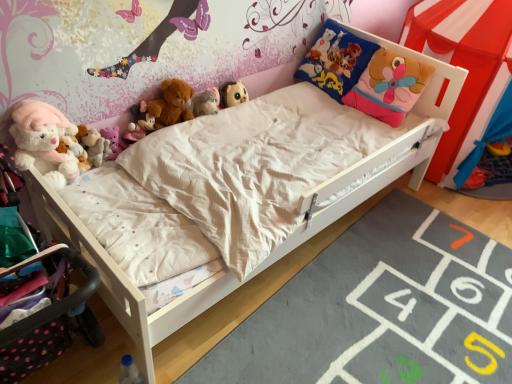
Question: From a real-world perspective, is blue plastic bottle at lower left, the 8th toy from the top, on soft plush pillow at upper right?

Choices:
 (A) no
 (B) yes

Answer: (A)

Question: Is blue plastic bottle at lower left, the first toy ordered from the bottom, at the right side of soft plush pillow at upper right?

Choices:
 (A) yes
 (B) no

Answer: (B)

Question: Is blue plastic bottle at lower left, the first toy ordered from the bottom, oriented away from soft plush pillow at upper right?

Choices:
 (A) yes
 (B) no

Answer: (B)

Question: Is the surface of blue plastic bottle at lower left, the first toy ordered from the bottom, in direct contact with soft plush pillow at upper right?

Choices:
 (A) no
 (B) yes

Answer: (A)

Question: From the image's perspective, is blue plastic bottle at lower left, the 8th toy from the top, on top of soft plush pillow at upper right?

Choices:
 (A) no
 (B) yes

Answer: (A)

Question: Considering the relative sizes of blue plastic bottle at lower left, the first toy ordered from the bottom, and soft plush pillow at upper right in the image provided, is blue plastic bottle at lower left, the first toy ordered from the bottom, thinner than soft plush pillow at upper right?

Choices:
 (A) no
 (B) yes

Answer: (B)

Question: Considering the relative sizes of fluffy white teddy bear at center, which ranks as the 1th toy in top-to-bottom order, and red fabric canopy bed at upper right in the image provided, is fluffy white teddy bear at center, which ranks as the 1th toy in top-to-bottom order, taller than red fabric canopy bed at upper right?

Choices:
 (A) yes
 (B) no

Answer: (B)

Question: Can you confirm if fluffy white teddy bear at center, positioned as the 8th toy in bottom-to-top order, is shorter than red fabric canopy bed at upper right?

Choices:
 (A) yes
 (B) no

Answer: (A)

Question: From the image's perspective, is fluffy white teddy bear at center, positioned as the 8th toy in bottom-to-top order, located beneath red fabric canopy bed at upper right?

Choices:
 (A) yes
 (B) no

Answer: (A)

Question: Is fluffy white teddy bear at center, positioned as the 8th toy in bottom-to-top order, at the right side of red fabric canopy bed at upper right?

Choices:
 (A) yes
 (B) no

Answer: (B)

Question: Does fluffy white teddy bear at center, which ranks as the 1th toy in top-to-bottom order, have a larger size compared to red fabric canopy bed at upper right?

Choices:
 (A) no
 (B) yes

Answer: (A)

Question: Does fluffy white teddy bear at center, positioned as the 8th toy in bottom-to-top order, have a lesser width compared to red fabric canopy bed at upper right?

Choices:
 (A) yes
 (B) no

Answer: (A)

Question: Considering the relative sizes of matte pink plush at upper left, which ranks as the fourth toy in top-to-bottom order, and blue plastic bottle at lower left, the first toy ordered from the bottom, in the image provided, is matte pink plush at upper left, which ranks as the fourth toy in top-to-bottom order, shorter than blue plastic bottle at lower left, the first toy ordered from the bottom,?

Choices:
 (A) no
 (B) yes

Answer: (B)